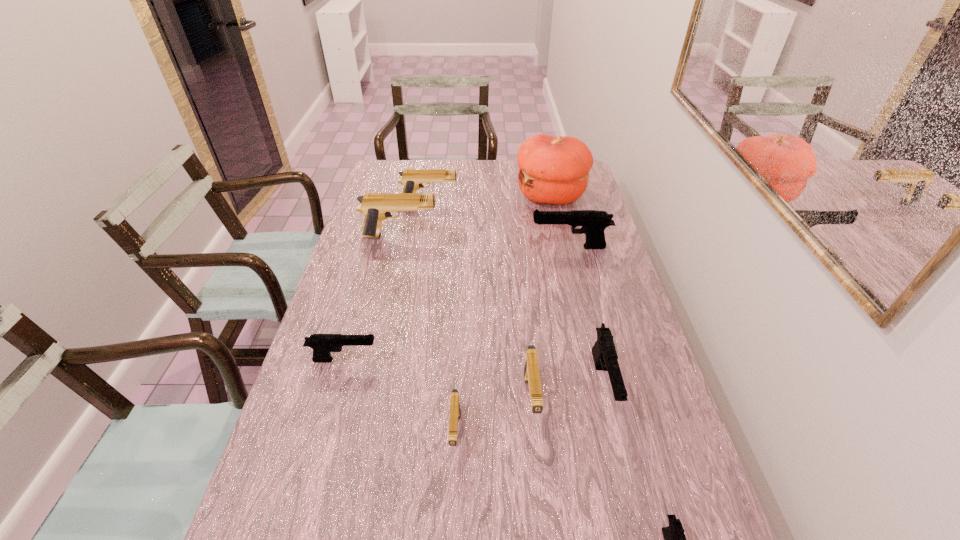
Locate an element on the screen. The image size is (960, 540). the third biggest black pistol is located at coordinates (322, 344).

Locate an element on the screen. the fifth pistol from right to left is located at coordinates (454, 402).

Find the location of `the smallest tan pistol`. the smallest tan pistol is located at coordinates (454, 402).

This screenshot has height=540, width=960. I want to click on blank space located 0.340m on the left of the pumpkin, so point(429,196).

The image size is (960, 540). I want to click on free space located 0.390m at the barrel of the biggest tan pistol, so click(x=549, y=237).

Locate an element on the screen. free point located on the front-facing side of the sixth nearest pistol is located at coordinates (431, 247).

Identify the location of blank space located on the front-facing side of the sixth nearest pistol. The image size is (960, 540). (510, 247).

The image size is (960, 540). I want to click on free space located 0.210m on the front-facing side of the sixth nearest pistol, so click(469, 247).

Find the location of `free space located at the barrel of the farthest tan pistol`. free space located at the barrel of the farthest tan pistol is located at coordinates (478, 203).

Where is `vacant position located on the front-facing side of the third smallest black pistol`? The image size is (960, 540). vacant position located on the front-facing side of the third smallest black pistol is located at coordinates (640, 535).